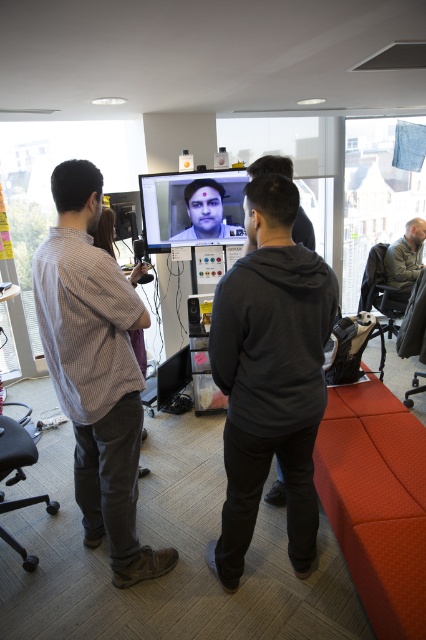
You are a photographer trying to capture a clear photo of the dark gray hoodie at center and the matte black face at center during the video call. Since both are in the frame, which object would you need to focus on first to ensure both are in focus?

The dark gray hoodie at center is taller than matte black face at center, so focusing on the dark gray hoodie at center first would ensure both are in focus as it is larger and occupies more space in the frame.

You are organizing a photo shoot and need to know which clothing item is narrower between the dark gray hoodie at center and the checkered fabric shirt at left. Which one should you choose?

The dark gray hoodie at center is thinner than the checkered fabric shirt at left, so you should choose the dark gray hoodie at center for a narrower appearance.